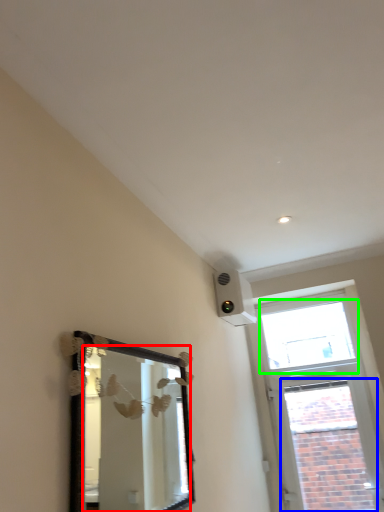
Question: Estimate the real-world distances between objects in this image. Which object is closer to mirror (highlighted by a red box), window (highlighted by a blue box) or window (highlighted by a green box)?

Choices:
 (A) window
 (B) window

Answer: (A)